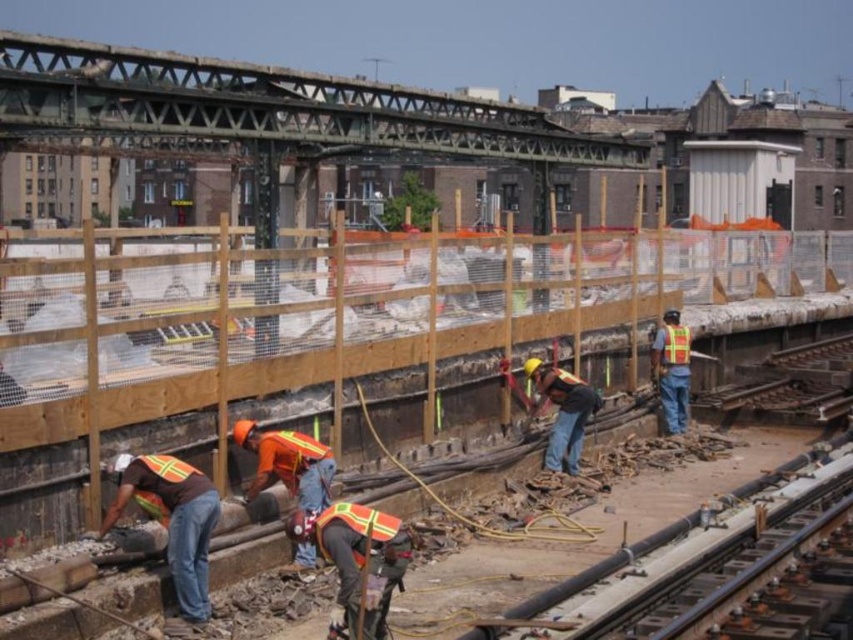
Can you confirm if reflective orange vest at center is positioned to the right of reflective yellow safety vest at center?

Incorrect, reflective orange vest at center is not on the right side of reflective yellow safety vest at center.

Who is more forward, (x=561, y=372) or (x=671, y=362)?

Point (x=561, y=372)

Who is more distant from viewer, (577, 410) or (682, 353)?

Positioned behind is point (682, 353).

Locate an element on the screen. Image resolution: width=853 pixels, height=640 pixels. reflective orange vest at center is located at coordinates (561, 412).

Does brown reflective vest at lower left come behind reflective orange vest at center?

That is False.

Who is positioned more to the left, brown reflective vest at lower left or reflective orange vest at center?

brown reflective vest at lower left is more to the left.

The image size is (853, 640). Identify the location of brown reflective vest at lower left. (172, 518).

The width and height of the screenshot is (853, 640). Identify the location of brown reflective vest at lower left. (172, 518).

Can you confirm if brown reflective vest at lower left is wider than reflective yellow safety vest at center?

Yes, brown reflective vest at lower left is wider than reflective yellow safety vest at center.

Does brown reflective vest at lower left have a greater height compared to reflective yellow safety vest at center?

Yes.

Where is `brown reflective vest at lower left`? Image resolution: width=853 pixels, height=640 pixels. brown reflective vest at lower left is located at coordinates (172, 518).